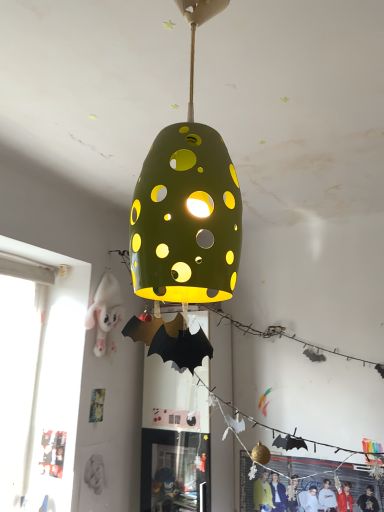
Question: Is point (104, 343) positioned closer to the camera than point (314, 504)?

Choices:
 (A) closer
 (B) farther

Answer: (B)

Question: Is white plush toy at left, acting as the 1th person starting from the top, in front of or behind matte black jacket at lower right, arranged as the 2th person when viewed from the left, in the image?

Choices:
 (A) behind
 (B) front

Answer: (A)

Question: Estimate the real-world distances between objects in this image. Which object is farther from the matte black jacket at lower right, arranged as the 1th person when ordered from the bottom?

Choices:
 (A) green matte lampshade at center
 (B) white plush toy at left, acting as the 1th person starting from the top

Answer: (A)

Question: Which of these objects is positioned farthest from the green matte lampshade at center?

Choices:
 (A) white plush toy at left, placed as the 2th person when sorted from bottom to top
 (B) matte black jacket at lower right, arranged as the 1th person when ordered from the bottom

Answer: (B)